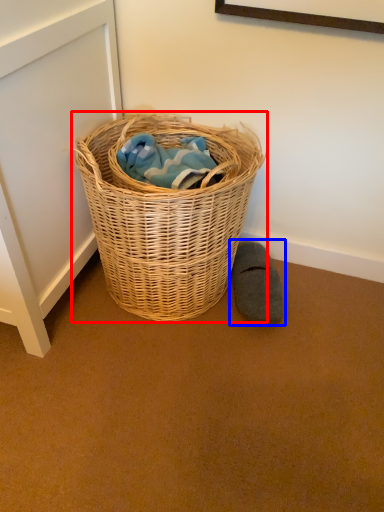
Question: Which object is closer to the camera taking this photo, picnic basket (highlighted by a red box) or footwear (highlighted by a blue box)?

Choices:
 (A) picnic basket
 (B) footwear

Answer: (A)